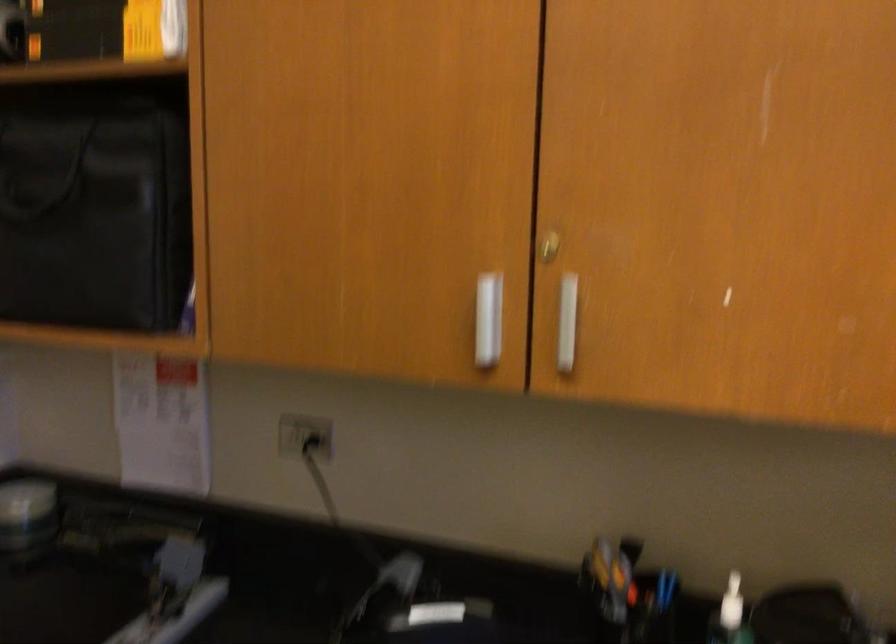
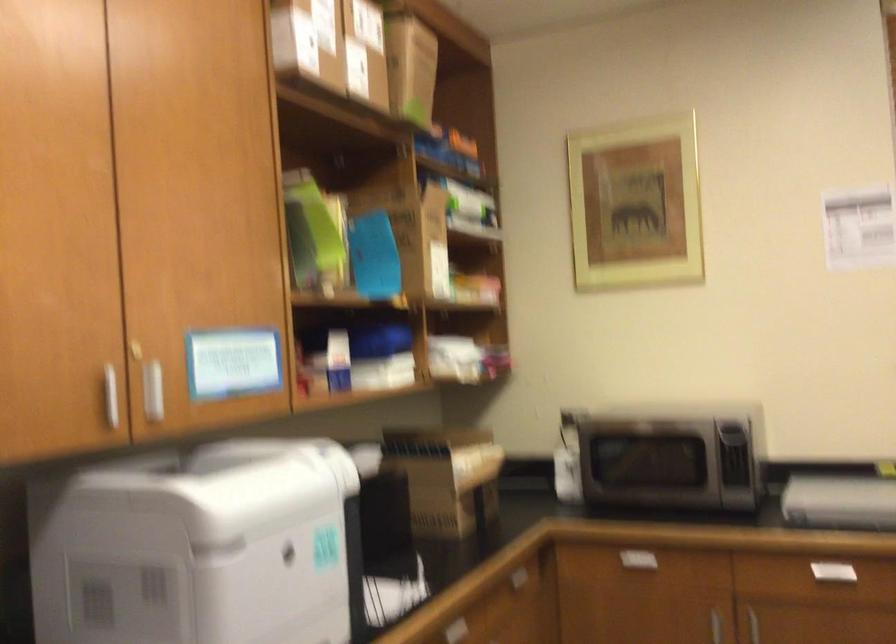
Question: Based on the continuous images, in which direction is the camera rotating? Reply with the corresponding letter.

Choices:
 (A) Left
 (B) Right
 (C) Up
 (D) Down

Answer: (B)